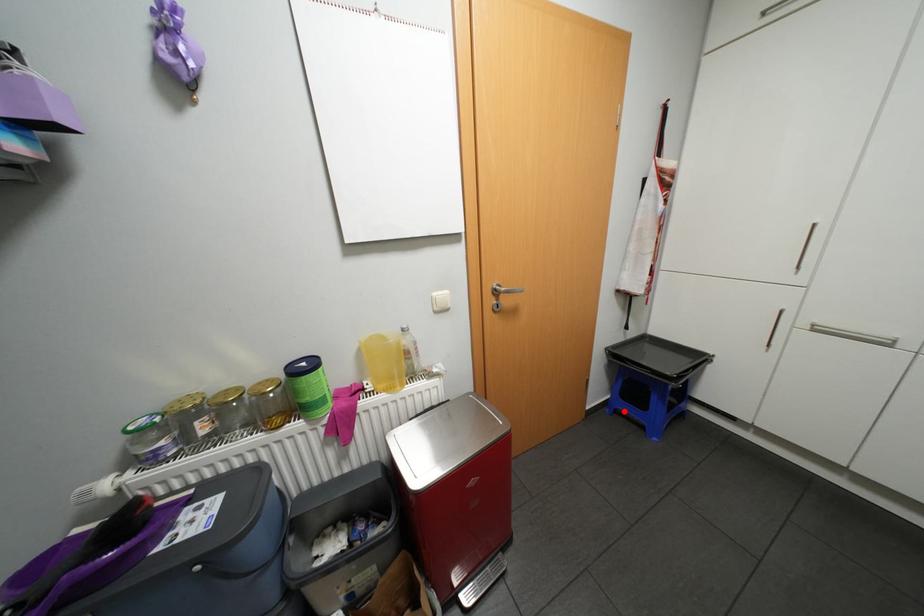
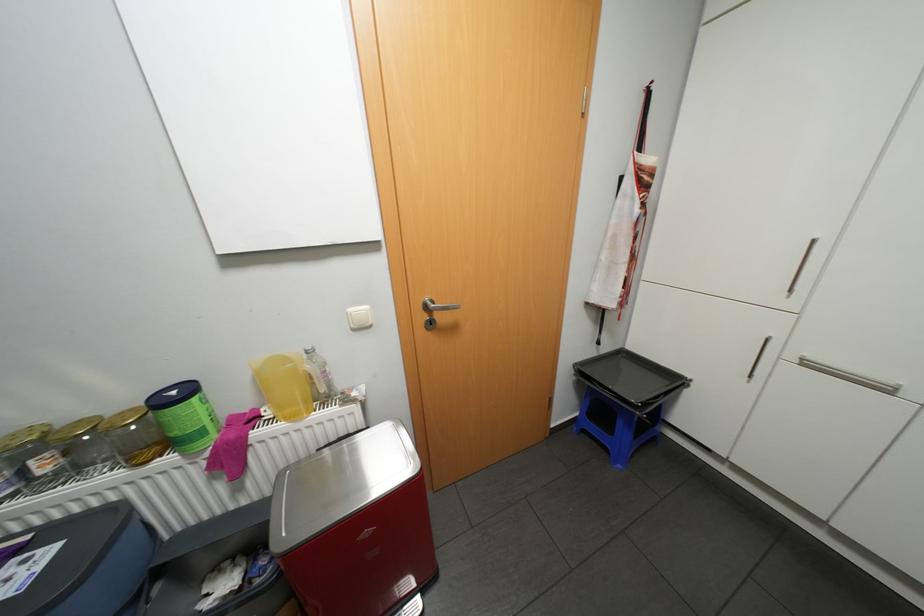
Question: A red point is marked in image1. In image2, is the corresponding 3D point closer to the camera or farther? Reply with the corresponding letter.

Choices:
 (A) The corresponding 3D point is closer.
 (B) The corresponding 3D point is farther.

Answer: (B)